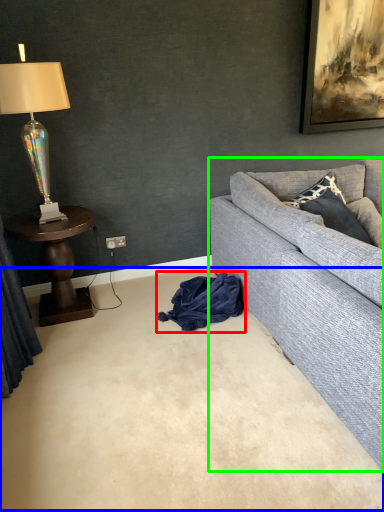
Question: Which is nearer to the material (highlighted by a red box)? plain (highlighted by a blue box) or studio couch (highlighted by a green box).

Choices:
 (A) plain
 (B) studio couch

Answer: (B)